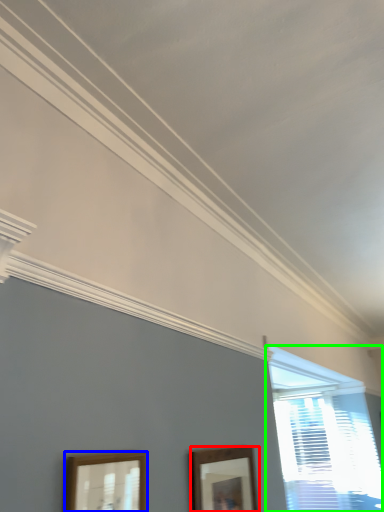
Question: Considering the real-world distances, which object is farthest from picture frame (highlighted by a red box)? picture frame (highlighted by a blue box) or window (highlighted by a green box)?

Choices:
 (A) picture frame
 (B) window

Answer: (B)